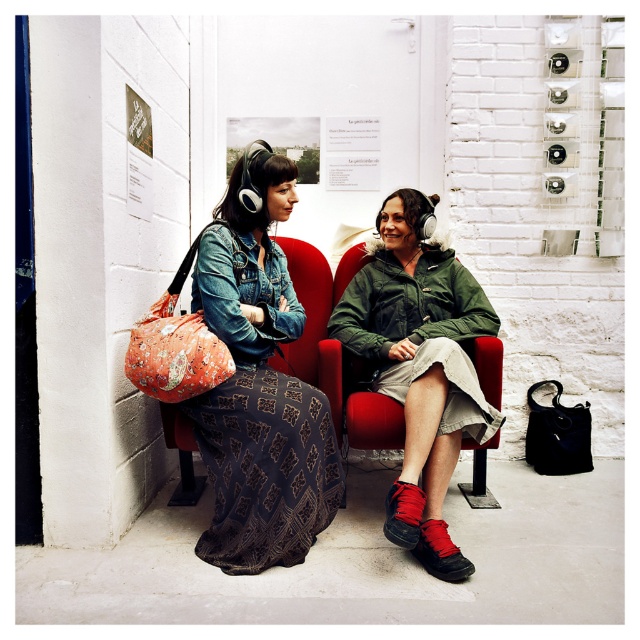
You are a photographer trying to capture a closeup of the denim jacket at left without including the green jacket and light colored shorts at right. Given that the point at (259, 385) is on the denim jacket at left, where should you focus your camera?

The point at (259, 385) is on the denim jacket at left, so focusing the camera there would capture the denim jacket without including the green jacket and light colored shorts at right.

You are trying to decide which jacket to buy based on size. You need a jacket that reaches your knees. The denim jacket at left is worn by someone sitting on a red chair, and the green matte jacket at center is worn by another person. Based on the image, which jacket would you choose?

The denim jacket at left is taller than the green matte jacket at center, so the denim jacket at left would reach your knees better.

You are standing 2 meters away from the point at coordinates point (278, 406). Can you reach it without moving closer?

The distance of point (278, 406) from viewer is 1.80 meters, so you are already 2 meters away from it. Therefore, you cannot reach it without moving closer.